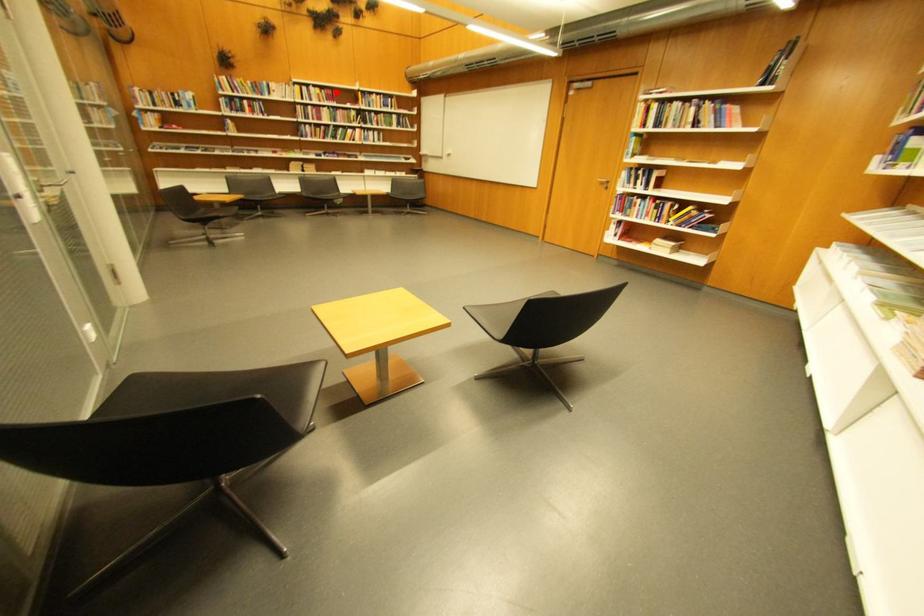
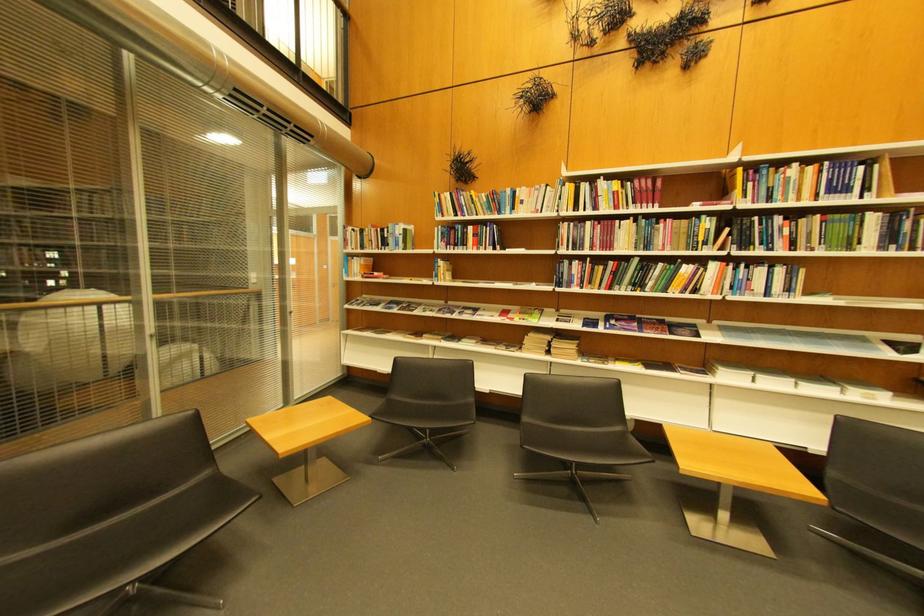
Question: I am providing you with two images of the same scene from different viewpoints. A red point is shown in image1. For the corresponding object point in image2, is it positioned nearer or farther from the camera?

Choices:
 (A) Nearer
 (B) Farther

Answer: (B)